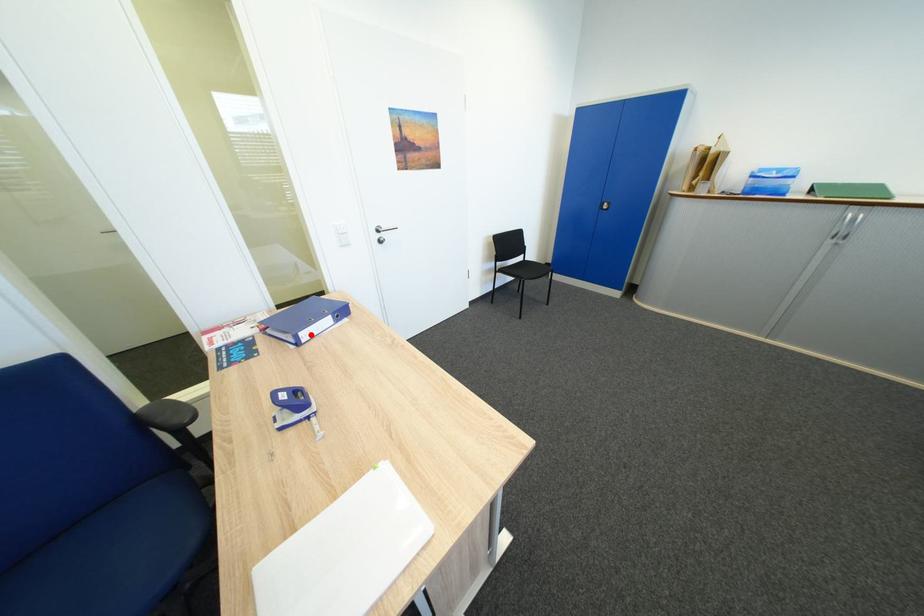
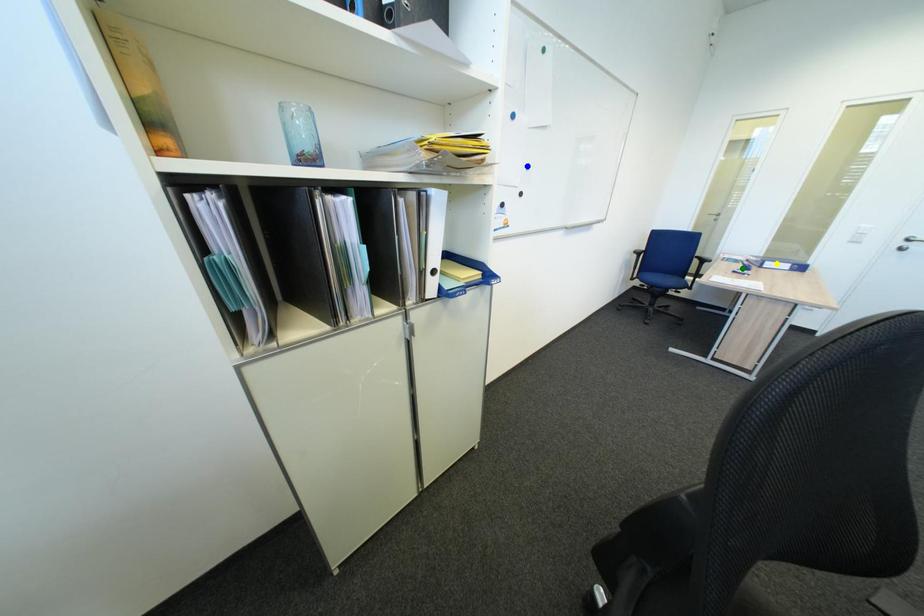
Question: I am providing you with two images of the same scene from different viewpoints. A red point is marked on the first image. You are given multiple points on the second image. Which point in image 2 represents the same 3d spot as the red point in image 1?

Choices:
 (A) green point
 (B) blue point
 (C) yellow point

Answer: (C)